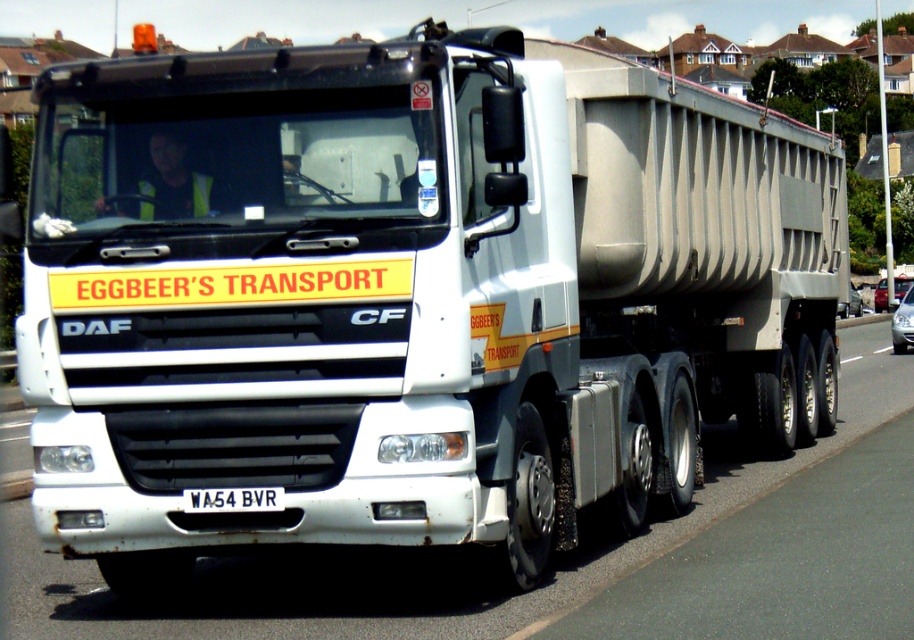
Does satin silver sedan at center have a lesser height compared to metallic silver car at right?

Correct, satin silver sedan at center is not as tall as metallic silver car at right.

Does satin silver sedan at center have a larger size compared to metallic silver car at right?

Indeed, satin silver sedan at center has a larger size compared to metallic silver car at right.

Does point (910, 340) come behind point (893, 291)?

No, (910, 340) is in front of (893, 291).

Find the location of a particular element. satin silver sedan at center is located at coordinates (902, 323).

Between white plastic license plate at center and metallic silver car at right, which one has less height?

white plastic license plate at center is shorter.

Does white plastic license plate at center come behind metallic silver car at right?

No, it is not.

Who is more distant from viewer, (225, 496) or (880, 285)?

Point (880, 285)

The width and height of the screenshot is (914, 640). I want to click on white plastic license plate at center, so click(x=232, y=499).

Who is more distant from viewer, (896, 310) or (859, 355)?

The point (896, 310) is behind.

Does satin silver sedan at center lie behind white rubber line at road center?

Yes, it is.

Which is behind, point (899, 300) or point (849, 356)?

Positioned behind is point (899, 300).

I want to click on satin silver sedan at center, so click(902, 323).